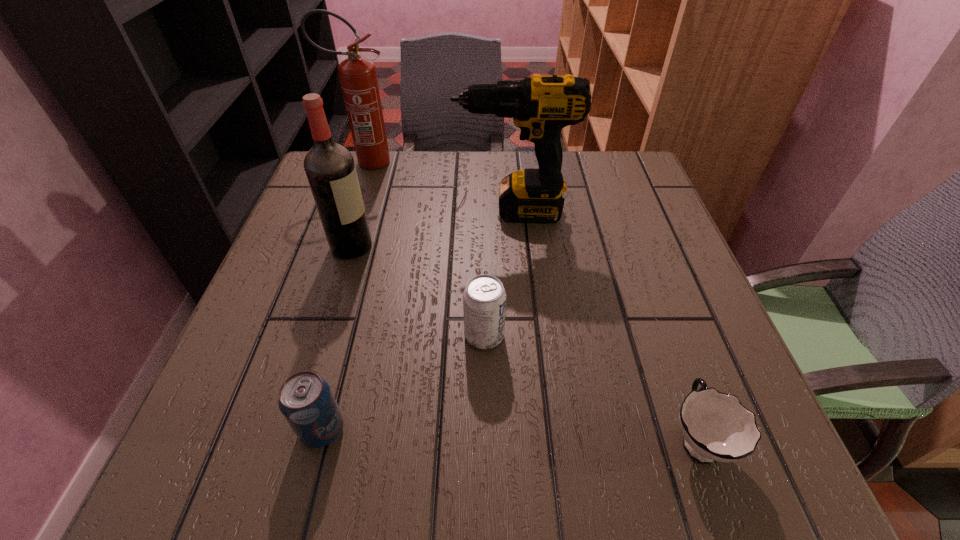
The width and height of the screenshot is (960, 540). What are the coordinates of `vacant space located at the tip of the second farthest object` in the screenshot? It's located at (325, 211).

Image resolution: width=960 pixels, height=540 pixels. In order to click on vacant region located at the tip of the second farthest object in this screenshot , I will do `click(373, 211)`.

Where is `free spot located 0.060m at the tip of the second farthest object`? This screenshot has width=960, height=540. free spot located 0.060m at the tip of the second farthest object is located at coordinates (430, 211).

At what (x,y) coordinates should I click in order to perform the action: click on vacant region located on the left of the fourth farthest object. Please return your answer as a coordinate pair (x, y). The image size is (960, 540). Looking at the image, I should click on (430, 335).

Image resolution: width=960 pixels, height=540 pixels. I want to click on free point located on the right of the left pop soda, so point(453,429).

The image size is (960, 540). Find the location of `free space located on the side of the shortest object with the handle`. free space located on the side of the shortest object with the handle is located at coordinates (627, 239).

The image size is (960, 540). I want to click on free spot located on the side of the shortest object with the handle, so click(660, 332).

This screenshot has height=540, width=960. Find the location of `free location located on the side of the shortest object with the handle`. free location located on the side of the shortest object with the handle is located at coordinates pos(660,332).

Where is `fire extinguisher at the far edge`? The image size is (960, 540). fire extinguisher at the far edge is located at coordinates (358, 77).

Where is `drill that is at the far edge`? drill that is at the far edge is located at coordinates (541, 106).